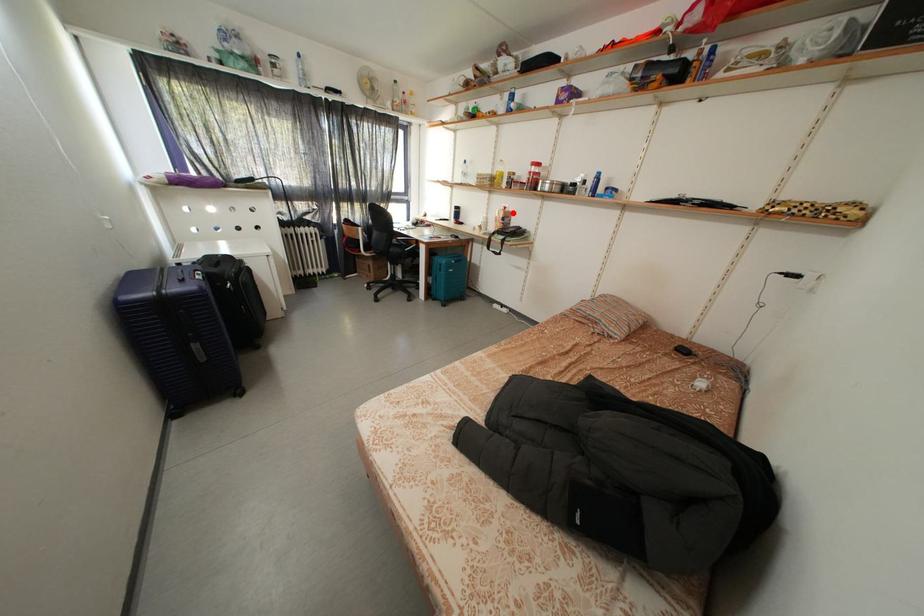
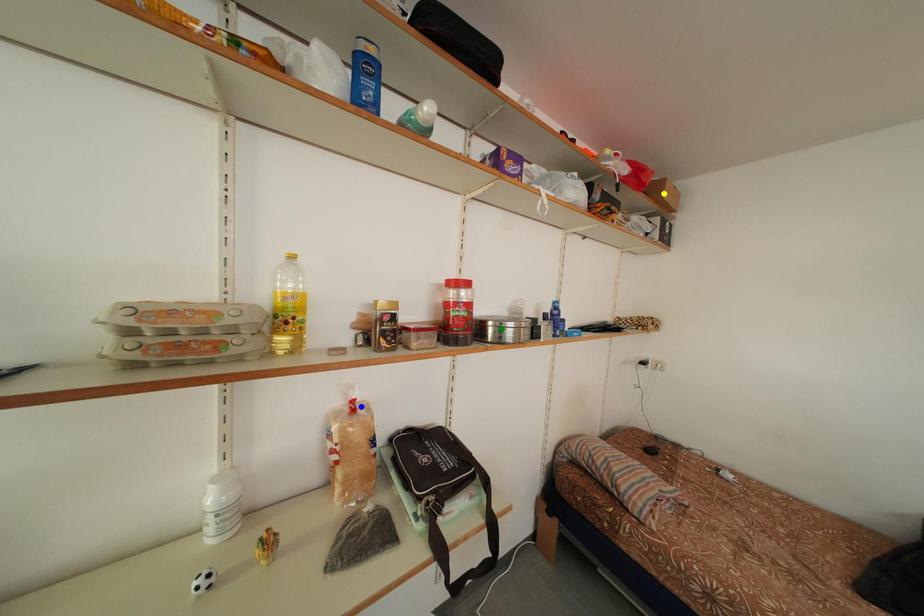
Question: I am providing you with two images of the same scene from different viewpoints. A red point is marked on the first image. You are given multiple points on the second image. Which mark in image 2 goes with the point in image 1?

Choices:
 (A) yellow point
 (B) blue point
 (C) green point

Answer: (B)